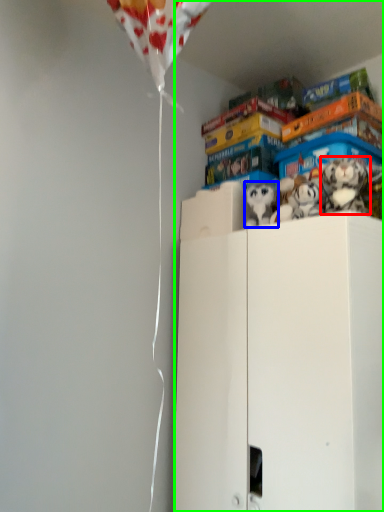
Question: Considering the real-world distances, which object is closest to toy (highlighted by a red box)? toy (highlighted by a blue box) or cabinetry (highlighted by a green box).

Choices:
 (A) toy
 (B) cabinetry

Answer: (A)